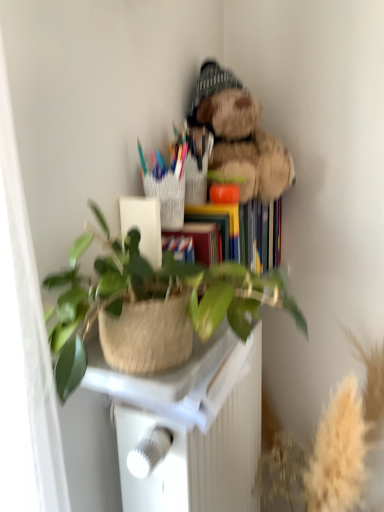
Question: Is green woven basket at center located outside fuzzy brown teddy bear at upper right?

Choices:
 (A) no
 (B) yes

Answer: (B)

Question: Is green woven basket at center thinner than fuzzy brown teddy bear at upper right?

Choices:
 (A) no
 (B) yes

Answer: (A)

Question: Considering the relative sizes of green woven basket at center and fuzzy brown teddy bear at upper right in the image provided, is green woven basket at center bigger than fuzzy brown teddy bear at upper right?

Choices:
 (A) yes
 (B) no

Answer: (A)

Question: Does green woven basket at center have a greater width compared to fuzzy brown teddy bear at upper right?

Choices:
 (A) no
 (B) yes

Answer: (B)

Question: Is green woven basket at center further to camera compared to fuzzy brown teddy bear at upper right?

Choices:
 (A) no
 (B) yes

Answer: (A)

Question: Based on their sizes in the image, would you say white plastic table at center is bigger or smaller than green woven basket at center?

Choices:
 (A) big
 (B) small

Answer: (A)

Question: In terms of width, does white plastic table at center look wider or thinner when compared to green woven basket at center?

Choices:
 (A) wide
 (B) thin

Answer: (B)

Question: In terms of height, does white plastic table at center look taller or shorter compared to green woven basket at center?

Choices:
 (A) short
 (B) tall

Answer: (B)

Question: Would you say white plastic table at center is inside or outside green woven basket at center?

Choices:
 (A) inside
 (B) outside

Answer: (B)

Question: Which is correct: fuzzy brown teddy bear at upper right is inside green woven basket at center, or outside of it?

Choices:
 (A) inside
 (B) outside

Answer: (B)

Question: In the image, is fuzzy brown teddy bear at upper right positioned in front of or behind green woven basket at center?

Choices:
 (A) front
 (B) behind

Answer: (B)

Question: Considering the positions of fuzzy brown teddy bear at upper right and green woven basket at center in the image, is fuzzy brown teddy bear at upper right taller or shorter than green woven basket at center?

Choices:
 (A) short
 (B) tall

Answer: (B)

Question: Is fuzzy brown teddy bear at upper right to the left or to the right of green woven basket at center in the image?

Choices:
 (A) left
 (B) right

Answer: (B)

Question: Is green woven basket at center taller or shorter than fuzzy brown teddy bear at upper right?

Choices:
 (A) short
 (B) tall

Answer: (A)

Question: From the image's perspective, is green woven basket at center positioned above or below fuzzy brown teddy bear at upper right?

Choices:
 (A) above
 (B) below

Answer: (B)